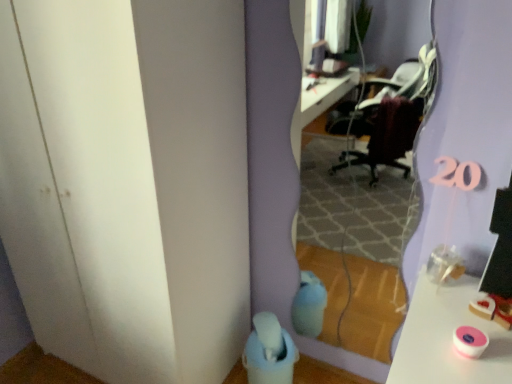
What do you see at coordinates (83, 188) in the screenshot? I see `transparent plastic door at lower left` at bounding box center [83, 188].

Find the location of `transparent plastic door at lower left`. transparent plastic door at lower left is located at coordinates (83, 188).

I want to click on clear glass mirror at center, so click(355, 246).

What is the approximate height of clear glass mirror at center?

clear glass mirror at center is 1.36 meters tall.

The image size is (512, 384). Describe the element at coordinates (355, 246) in the screenshot. I see `clear glass mirror at center` at that location.

You are a GUI agent. You are given a task and a screenshot of the screen. Output one action in this format:
    pyautogui.click(x=<x>, y=<y>)
    Task: Click on the transparent plastic door at lower left
    Image resolution: width=512 pixels, height=384 pixels.
    Given the screenshot: What is the action you would take?
    pyautogui.click(x=83, y=188)

In the image, is transparent plastic door at lower left on the left side or the right side of clear glass mirror at center?

In the image, transparent plastic door at lower left appears on the left side of clear glass mirror at center.

Does transparent plastic door at lower left come in front of clear glass mirror at center?

Yes, transparent plastic door at lower left is closer to the viewer.

Is point (158, 358) positioned before point (376, 197)?

Yes, point (158, 358) is in front of point (376, 197).

From the image's perspective, is transparent plastic door at lower left over clear glass mirror at center?

Yes, from the image's perspective, transparent plastic door at lower left is over clear glass mirror at center.

From a real-world perspective, which is physically above, transparent plastic door at lower left or clear glass mirror at center?

From a 3D spatial view, clear glass mirror at center is above.

Looking at this image, between transparent plastic door at lower left and clear glass mirror at center, which one has larger width?

Wider between the two is transparent plastic door at lower left.

Who is taller, transparent plastic door at lower left or clear glass mirror at center?

transparent plastic door at lower left is taller.

Which of these two, transparent plastic door at lower left or clear glass mirror at center, is bigger?

transparent plastic door at lower left.

Is transparent plastic door at lower left outside of clear glass mirror at center?

Yes.

Is there a large distance between transparent plastic door at lower left and clear glass mirror at center?

transparent plastic door at lower left is positioned a significant distance from clear glass mirror at center.

Is transparent plastic door at lower left aimed at clear glass mirror at center?

No.

In the scene shown: How many degrees apart are the facing directions of transparent plastic door at lower left and clear glass mirror at center?

transparent plastic door at lower left and clear glass mirror at center are facing 1.34 degrees away from each other.

The image size is (512, 384). What are the coordinates of `glass door that is under the clear glass mirror at center (from a real-world perspective)` in the screenshot? It's located at (83, 188).

Does clear glass mirror at center appear on the right side of transparent plastic door at lower left?

Correct, you'll find clear glass mirror at center to the right of transparent plastic door at lower left.

Relative to transparent plastic door at lower left, is clear glass mirror at center in front or behind?

Visually, clear glass mirror at center is located behind transparent plastic door at lower left.

Consider the image. Which point is more distant from viewer, (x=401, y=284) or (x=126, y=240)?

The point (x=401, y=284) is farther from the camera.

From the image's perspective, is clear glass mirror at center located above or below transparent plastic door at lower left?

Clearly, from the image's perspective, clear glass mirror at center is below transparent plastic door at lower left.

From a real-world perspective, between clear glass mirror at center and transparent plastic door at lower left, who is vertically lower?

transparent plastic door at lower left.

In terms of width, does clear glass mirror at center look wider or thinner when compared to transparent plastic door at lower left?

clear glass mirror at center is thinner than transparent plastic door at lower left.

Can you confirm if clear glass mirror at center is taller than transparent plastic door at lower left?

No.

Is clear glass mirror at center bigger or smaller than transparent plastic door at lower left?

In the image, clear glass mirror at center appears to be smaller than transparent plastic door at lower left.

Can we say clear glass mirror at center lies outside transparent plastic door at lower left?

That's correct, clear glass mirror at center is outside of transparent plastic door at lower left.

Are clear glass mirror at center and transparent plastic door at lower left beside each other?

No, clear glass mirror at center is not making contact with transparent plastic door at lower left.

Is clear glass mirror at center looking in the opposite direction of transparent plastic door at lower left?

No, clear glass mirror at center is not facing the opposite direction of transparent plastic door at lower left.

How many degrees apart are the facing directions of clear glass mirror at center and transparent plastic door at lower left?

The facing directions of clear glass mirror at center and transparent plastic door at lower left are 1.34 degrees apart.

How far apart are clear glass mirror at center and transparent plastic door at lower left?

clear glass mirror at center and transparent plastic door at lower left are 4.83 feet apart.

In the image, there is a transparent plastic door at lower left. Where is `mirror below it (from the image's perspective)`? mirror below it (from the image's perspective) is located at coordinates (355, 246).

Where is `glass door that appears on the left of clear glass mirror at center`? The image size is (512, 384). glass door that appears on the left of clear glass mirror at center is located at coordinates (83, 188).

At what (x,y) coordinates should I click in order to perform the action: click on mirror on the right of transparent plastic door at lower left. Please return your answer as a coordinate pair (x, y). The height and width of the screenshot is (384, 512). Looking at the image, I should click on (355, 246).